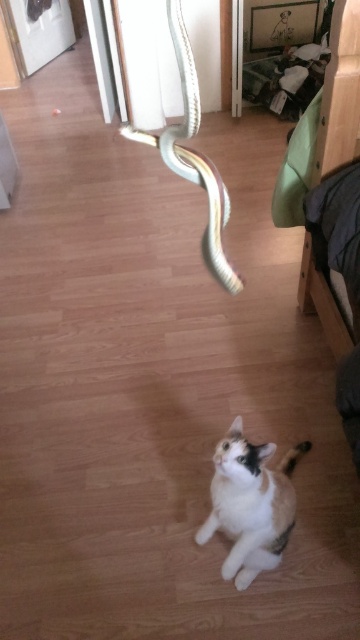
You are a visitor in the room and want to know if the calico fur cat at center can see the white glossy tail at lower center. Based on their positions, can you determine if the cat has a clear line of sight to the tail?

The calico fur cat at center is in front of the white glossy tail at lower center, so the cat is positioned closer to the viewer and directly in front of the tail. This means the cat likely has a clear line of sight to the white glossy tail at lower center as there are no objects mentioned blocking the view between them.

You are a pet owner who wants to ensure the safety of your calico fur cat at center. The shiny metallic snake at upper center is a toy. Can the cat reach the snake toy if it jumps? Please consider the distance between them.

The distance between the calico fur cat at center and the shiny metallic snake at upper center is 25.59 inches. Since the snake is a toy suspended midair, the cat may not be able to reach it with a simple jump unless it has exceptional jumping ability. The distance is about 2 feet, which is quite far for a typical cat jump.

You are a pet owner who just found your cat in the room with the shiny metallic snake at upper center and the white glossy tail at lower center. You want to know which object is larger to assess potential risks. Which one is bigger?

The shiny metallic snake at upper center is bigger than the white glossy tail at lower center, so the snake poses a larger potential risk.